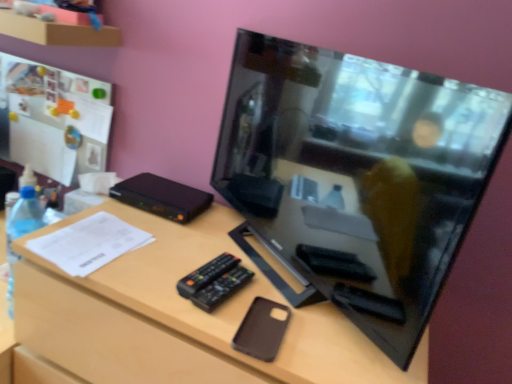
Locate an element on the screen. unoccupied area in front of black plastic remote at center is located at coordinates (222, 322).